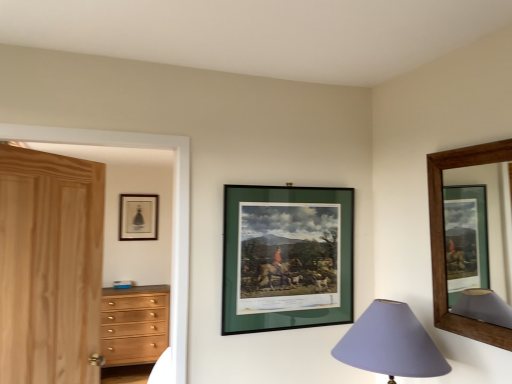
What are the coordinates of `brown wooden picture frame at upper right, the third picture frame in the back-to-front sequence` in the screenshot? It's located at (443, 239).

The image size is (512, 384). What do you see at coordinates (138, 217) in the screenshot?
I see `matte black frame at upper left, arranged as the 1th picture frame when viewed from the left` at bounding box center [138, 217].

Identify the location of natural wood door at left. This screenshot has width=512, height=384. (50, 267).

This screenshot has height=384, width=512. Describe the element at coordinates (50, 267) in the screenshot. I see `natural wood door at left` at that location.

The image size is (512, 384). Identify the location of wooden chest of drawers at left. (134, 324).

I want to click on brown wooden picture frame at upper right, which is the 3th picture frame in left-to-right order, so click(443, 239).

Considering the points (110, 300) and (403, 345), which point is in front, point (110, 300) or point (403, 345)?

The point (403, 345) is more forward.

From a real-world perspective, which is physically below, wooden chest of drawers at left or purple fabric lampshade at lower right?

wooden chest of drawers at left, from a real-world perspective.

Is wooden chest of drawers at left next to purple fabric lampshade at lower right?

wooden chest of drawers at left is not next to purple fabric lampshade at lower right, and they're not touching.

Considering the sizes of wooden chest of drawers at left and purple fabric lampshade at lower right in the image, is wooden chest of drawers at left taller or shorter than purple fabric lampshade at lower right?

Clearly, wooden chest of drawers at left is taller compared to purple fabric lampshade at lower right.

Is natural wood door at left far away from matte black frame at upper left, the third picture frame when ordered from front to back?

Indeed, natural wood door at left is not near matte black frame at upper left, the third picture frame when ordered from front to back.

Locate an element on the screen. This screenshot has width=512, height=384. picture frame on the left of natural wood door at left is located at coordinates (138, 217).

From the image's perspective, is natural wood door at left above matte black frame at upper left, which is counted as the 3th picture frame, starting from the right?

No, from the image's perspective, natural wood door at left is not on top of matte black frame at upper left, which is counted as the 3th picture frame, starting from the right.

Is purple fabric lampshade at lower right smaller than green matte picture frame at center, which ranks as the second picture frame in left-to-right order?

Incorrect, purple fabric lampshade at lower right is not smaller in size than green matte picture frame at center, which ranks as the second picture frame in left-to-right order.

Is purple fabric lampshade at lower right with green matte picture frame at center, which ranks as the second picture frame in left-to-right order?

No, purple fabric lampshade at lower right is not making contact with green matte picture frame at center, which ranks as the second picture frame in left-to-right order.

Is purple fabric lampshade at lower right positioned beyond the bounds of green matte picture frame at center, which ranks as the second picture frame in left-to-right order?

purple fabric lampshade at lower right is positioned outside green matte picture frame at center, which ranks as the second picture frame in left-to-right order.

Is point (387, 337) closer or farther from the camera than point (309, 262)?

Point (387, 337).

Are natural wood door at left and green matte picture frame at center, which is the 2th picture frame from back to front, located far from each other?

No, natural wood door at left is in close proximity to green matte picture frame at center, which is the 2th picture frame from back to front.

From a real-world perspective, who is located lower, natural wood door at left or green matte picture frame at center, which ranks as the second picture frame in left-to-right order?

From a 3D spatial view, natural wood door at left is below.

Is natural wood door at left closer to camera compared to green matte picture frame at center, arranged as the 2th picture frame when viewed from the front?

Yes.

Locate an element on the screen. The width and height of the screenshot is (512, 384). door below the green matte picture frame at center, which is the 2th picture frame from back to front (from the image's perspective) is located at coordinates (50, 267).

From the image's perspective, would you say wooden chest of drawers at left is positioned over matte black frame at upper left, which appears as the first picture frame when viewed from the back?

Incorrect, from the image's perspective, wooden chest of drawers at left is lower than matte black frame at upper left, which appears as the first picture frame when viewed from the back.

Are wooden chest of drawers at left and matte black frame at upper left, which appears as the first picture frame when viewed from the back, located far from each other?

Absolutely, wooden chest of drawers at left is distant from matte black frame at upper left, which appears as the first picture frame when viewed from the back.

How many degrees apart are the facing directions of wooden chest of drawers at left and matte black frame at upper left, which appears as the first picture frame when viewed from the back?

wooden chest of drawers at left and matte black frame at upper left, which appears as the first picture frame when viewed from the back, are facing 0.627 degrees away from each other.

Which is closer, [158,355] or [133,212]?

The point [158,355] is more forward.

Does matte black frame at upper left, the third picture frame when ordered from front to back, turn towards green matte picture frame at center, which ranks as the second picture frame in left-to-right order?

Yes, matte black frame at upper left, the third picture frame when ordered from front to back, is oriented towards green matte picture frame at center, which ranks as the second picture frame in left-to-right order.

Locate an element on the screen. picture frame located on the left of green matte picture frame at center, arranged as the 2th picture frame when viewed from the front is located at coordinates (138, 217).

Can you tell me how much matte black frame at upper left, which is counted as the 3th picture frame, starting from the right, and green matte picture frame at center, arranged as the 2th picture frame when viewed from the front, differ in facing direction?

There is a 4.81-degree angle between the facing directions of matte black frame at upper left, which is counted as the 3th picture frame, starting from the right, and green matte picture frame at center, arranged as the 2th picture frame when viewed from the front.

Who is taller, matte black frame at upper left, which is counted as the 3th picture frame, starting from the right, or green matte picture frame at center, which is the 2th picture frame from back to front?

green matte picture frame at center, which is the 2th picture frame from back to front, is taller.

Is the depth of brown wooden picture frame at upper right, acting as the 1th picture frame starting from the front, less than that of green matte picture frame at center, which is the 2th picture frame from back to front?

Yes.

Which of these two, brown wooden picture frame at upper right, which is the 3th picture frame in left-to-right order, or green matte picture frame at center, which is the 2th picture frame from back to front, is wider?

With larger width is brown wooden picture frame at upper right, which is the 3th picture frame in left-to-right order.

Which is more to the right, brown wooden picture frame at upper right, the third picture frame in the back-to-front sequence, or green matte picture frame at center, which ranks as the second picture frame in left-to-right order?

From the viewer's perspective, brown wooden picture frame at upper right, the third picture frame in the back-to-front sequence, appears more on the right side.

From a real-world perspective, who is located higher, brown wooden picture frame at upper right, marked as the 1th picture frame in a right-to-left arrangement, or green matte picture frame at center, arranged as the 2th picture frame when viewed from the front?

In real-world perspective, brown wooden picture frame at upper right, marked as the 1th picture frame in a right-to-left arrangement, is above.

I want to click on lamp that appears above the wooden chest of drawers at left (from a real-world perspective), so click(x=390, y=343).

This screenshot has height=384, width=512. In order to click on door located below the matte black frame at upper left, which appears as the first picture frame when viewed from the back (from the image's perspective) in this screenshot , I will do `click(50, 267)`.

When comparing their distances from matte black frame at upper left, which is counted as the 3th picture frame, starting from the right, does brown wooden picture frame at upper right, which is the 3th picture frame in left-to-right order, or purple fabric lampshade at lower right seem further?

The object further to matte black frame at upper left, which is counted as the 3th picture frame, starting from the right, is brown wooden picture frame at upper right, which is the 3th picture frame in left-to-right order.

Based on their spatial positions, is natural wood door at left or wooden chest of drawers at left further from green matte picture frame at center, which ranks as the second picture frame in left-to-right order?

wooden chest of drawers at left is positioned further to the anchor green matte picture frame at center, which ranks as the second picture frame in left-to-right order.

Looking at this image, from the image, which object appears to be nearer to matte black frame at upper left, which appears as the first picture frame when viewed from the back, purple fabric lampshade at lower right or natural wood door at left?

natural wood door at left is positioned closer to the anchor matte black frame at upper left, which appears as the first picture frame when viewed from the back.

Which object lies nearer to the anchor point green matte picture frame at center, the second picture frame positioned from the right, brown wooden picture frame at upper right, marked as the 1th picture frame in a right-to-left arrangement, or natural wood door at left?

brown wooden picture frame at upper right, marked as the 1th picture frame in a right-to-left arrangement, is closer to green matte picture frame at center, the second picture frame positioned from the right.

In the scene shown: Which object lies further to the anchor point wooden chest of drawers at left, brown wooden picture frame at upper right, marked as the 1th picture frame in a right-to-left arrangement, or purple fabric lampshade at lower right?

The object further to wooden chest of drawers at left is brown wooden picture frame at upper right, marked as the 1th picture frame in a right-to-left arrangement.

Based on their spatial positions, is matte black frame at upper left, arranged as the 1th picture frame when viewed from the left, or green matte picture frame at center, which ranks as the second picture frame in left-to-right order, closer to natural wood door at left?

Among the two, green matte picture frame at center, which ranks as the second picture frame in left-to-right order, is located nearer to natural wood door at left.

Considering their positions, is natural wood door at left positioned further to brown wooden picture frame at upper right, which is the 3th picture frame in left-to-right order, than green matte picture frame at center, which is the 2th picture frame from back to front?

natural wood door at left lies further to brown wooden picture frame at upper right, which is the 3th picture frame in left-to-right order, than the other object.

Considering their positions, is natural wood door at left positioned closer to green matte picture frame at center, arranged as the 2th picture frame when viewed from the front, than brown wooden picture frame at upper right, the third picture frame in the back-to-front sequence?

brown wooden picture frame at upper right, the third picture frame in the back-to-front sequence, is closer to green matte picture frame at center, arranged as the 2th picture frame when viewed from the front.

Find the location of a particular element. picture frame between natural wood door at left and brown wooden picture frame at upper right, the third picture frame in the back-to-front sequence, in the horizontal direction is located at coordinates (287, 258).

This screenshot has width=512, height=384. In order to click on chest of drawers between natural wood door at left and matte black frame at upper left, arranged as the 1th picture frame when viewed from the left, from front to back in this screenshot , I will do `click(134, 324)`.

I want to click on lamp between natural wood door at left and brown wooden picture frame at upper right, the third picture frame in the back-to-front sequence, so click(x=390, y=343).

You are a GUI agent. You are given a task and a screenshot of the screen. Output one action in this format:
    pyautogui.click(x=<x>, y=<y>)
    Task: Click on the lamp located between brown wooden picture frame at upper right, marked as the 1th picture frame in a right-to-left arrangement, and matte black frame at upper left, which is counted as the 3th picture frame, starting from the right, in the depth direction
    The image size is (512, 384).
    Given the screenshot: What is the action you would take?
    pyautogui.click(x=390, y=343)